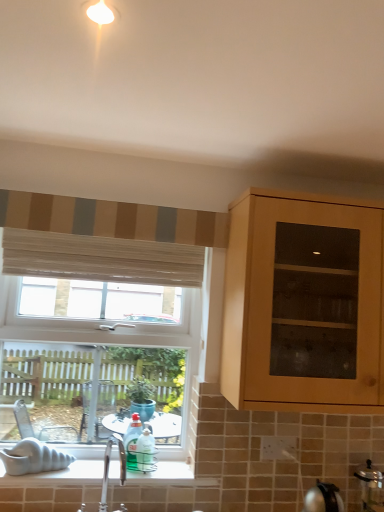
Question: Is polished chrome tap at lower center spatially inside wooden blinds at upper left, the second curtain viewed from the top, or outside of it?

Choices:
 (A) inside
 (B) outside

Answer: (B)

Question: Is polished chrome tap at lower center bigger or smaller than wooden blinds at upper left, acting as the 1th curtain starting from the bottom?

Choices:
 (A) small
 (B) big

Answer: (A)

Question: Which object is the closest to the wooden blinds at upper left, the second curtain viewed from the top?

Choices:
 (A) polished chrome tap at lower center
 (B) clear glass window at lower left
 (C) satin silver pressure cooker at lower right
 (D) striped fabric at upper left, arranged as the 2th curtain when ordered from the bottom
 (E) translucent plastic bottle at window

Answer: (D)

Question: Estimate the real-world distances between objects in this image. Which object is farther from the clear glass window at lower left?

Choices:
 (A) translucent plastic bottle at window
 (B) satin silver pressure cooker at lower right
 (C) striped fabric at upper left, which is the first curtain from top to bottom
 (D) polished chrome tap at lower center
 (E) wooden blinds at upper left, acting as the 1th curtain starting from the bottom

Answer: (B)